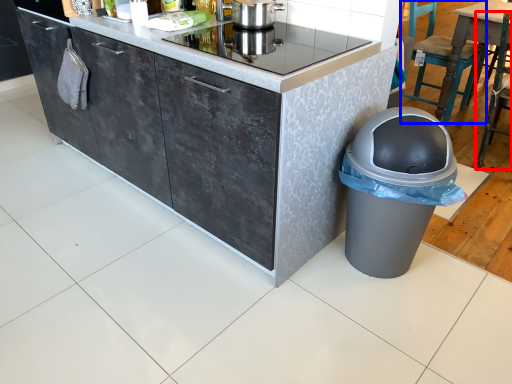
Question: Which object is further to the camera taking this photo, chair (highlighted by a red box) or chair (highlighted by a blue box)?

Choices:
 (A) chair
 (B) chair

Answer: (B)